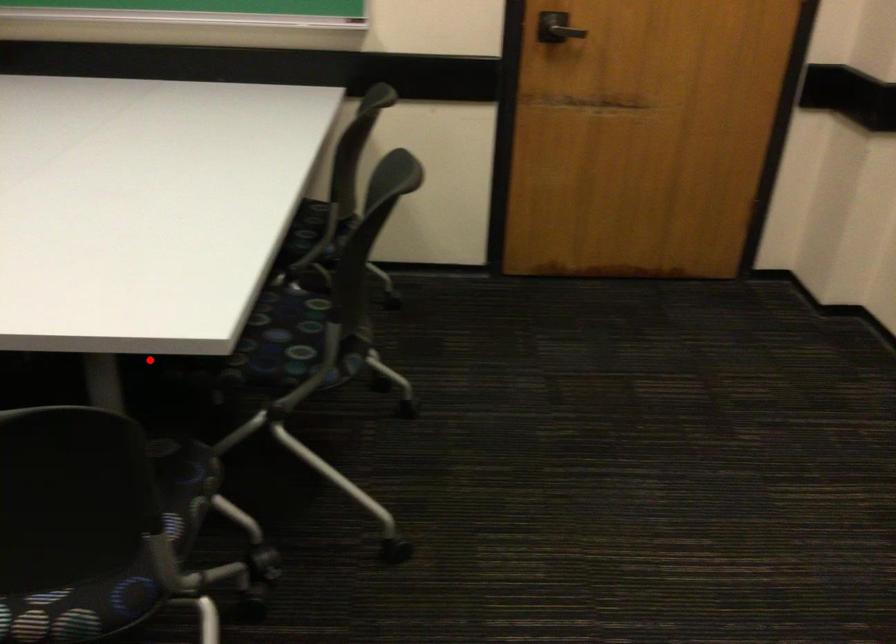
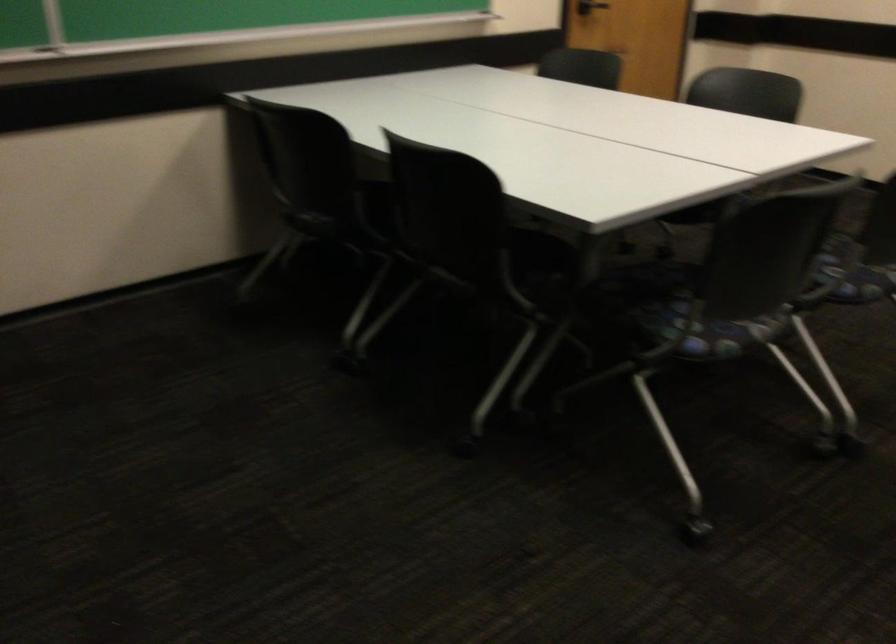
Locate, in the second image, the point that corresponds to the highlighted location in the first image.

(703, 214)